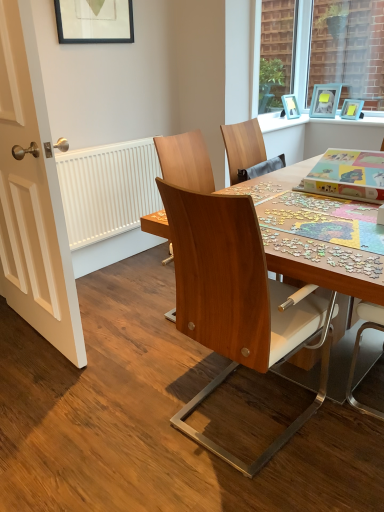
Locate an element on the screen. This screenshot has height=512, width=384. free region under white matte radiator at left (from a real-world perspective) is located at coordinates (120, 262).